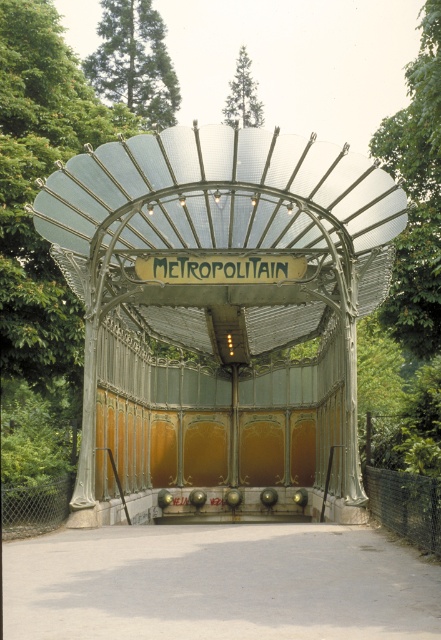
You are a visitor standing in front of the Metropolitain station entrance. You notice two green leafy trees in the upper part of the scene. Which tree is closer to the entrance structure? Please choose between the green leafy tree at upper left and the green leafy tree at upper center.

The green leafy tree at upper left is positioned under the green leafy tree at upper center, so the green leafy tree at upper left is closer to the entrance structure.

You are standing at the entrance of the Metropolitain station and see the metallic glass gazebo at center and the green leafy tree at upper center. Which object is closer to you?

The metallic glass gazebo at center is closer to you because it is in front of the green leafy tree at upper center.